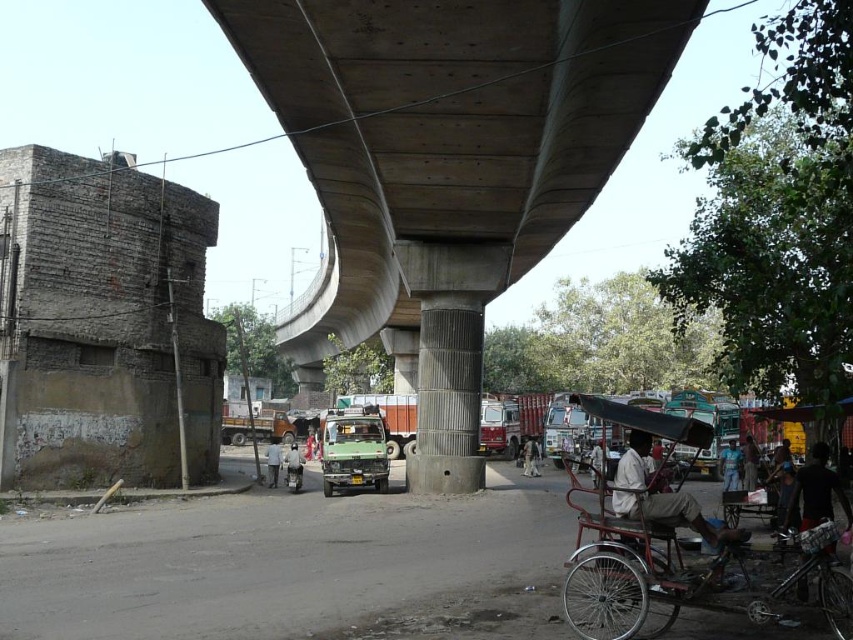
You are a pedestrian standing at the edge of the street near the brick building. You see a metallic red rickshaw at lower right and a light blue shirt at center. Which object is closer to your current position?

The light blue shirt at center is closer to your current position because the metallic red rickshaw at lower right is to the right of the light blue shirt at center, meaning the shirt is between you and the rickshaw.